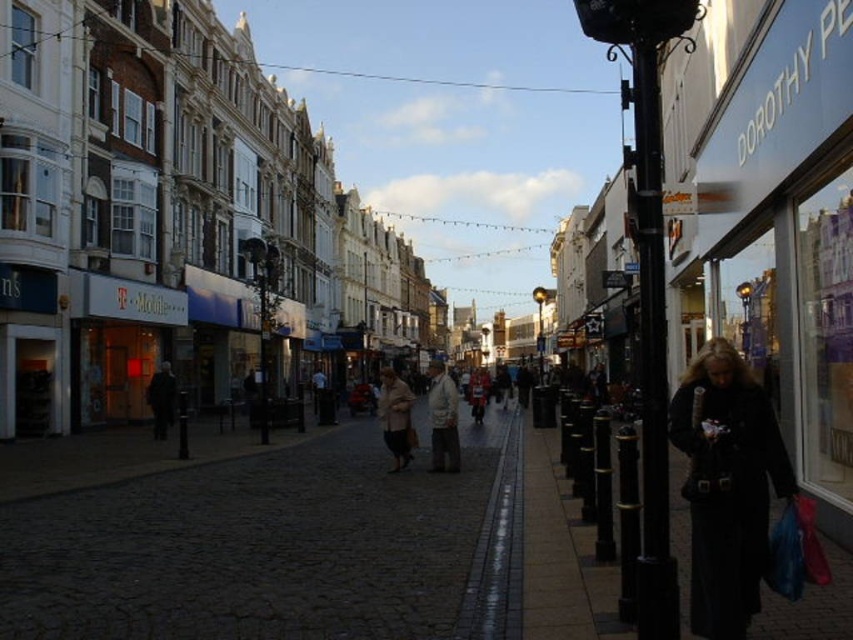
Question: Is red plastic bag at lower right to the right of white textured coat at center from the viewer's perspective?

Choices:
 (A) no
 (B) yes

Answer: (B)

Question: Which of the following is the closest to the observer?

Choices:
 (A) white textured coat at center
 (B) dark cobblestone pavement at center

Answer: (B)

Question: Which point is closer to the camera?

Choices:
 (A) (160, 436)
 (B) (404, 451)
 (C) (432, 449)

Answer: (B)

Question: Is the position of black leather coat at lower right more distant than that of light beige coat at center?

Choices:
 (A) yes
 (B) no

Answer: (B)

Question: Does light beige coat at center have a larger size compared to dark gray coat at left?

Choices:
 (A) no
 (B) yes

Answer: (B)

Question: Which object is positioned closest to the red plastic bag at lower right?

Choices:
 (A) dark cobblestone pavement at center
 (B) light beige coat at center
 (C) dark gray coat at left

Answer: (A)